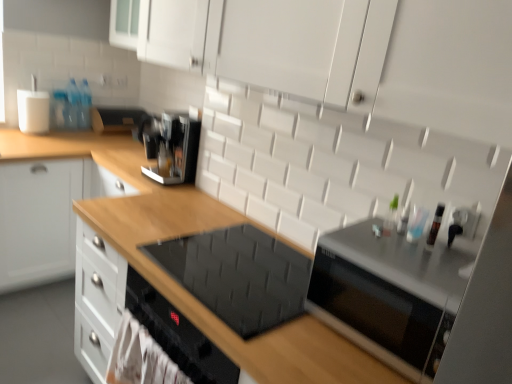
In the scene shown: Measure the distance between point (115, 131) and camera.

Point (115, 131) and camera are 9.15 feet apart.

Where is `black glass cooktop at center`? The image size is (512, 384). black glass cooktop at center is located at coordinates (238, 275).

Where is `sleek metallic coffee maker at upper center`? Image resolution: width=512 pixels, height=384 pixels. sleek metallic coffee maker at upper center is located at coordinates (172, 148).

The image size is (512, 384). I want to click on wooden drawer at left, so click(45, 216).

At what (x,y) coordinates should I click in order to perform the action: click on sleek metallic microwave at right, which is the 2th appliance in top-to-bottom order. Please return your answer as a coordinate pair (x, y). The width and height of the screenshot is (512, 384). Looking at the image, I should click on (388, 294).

What do you see at coordinates (388, 294) in the screenshot? This screenshot has height=384, width=512. I see `sleek metallic microwave at right, the first appliance from the front` at bounding box center [388, 294].

In order to click on transparent plastic bottle at upper right, the 1th bottle from the right in this screenshot , I will do `click(435, 226)`.

Choose the correct answer: Is black glass cooktop at center inside clear plastic bottle at upper left, acting as the first bottle starting from the left, or outside it?

black glass cooktop at center cannot be found inside clear plastic bottle at upper left, acting as the first bottle starting from the left.

How much distance is there between black glass cooktop at center and clear plastic bottle at upper left, acting as the second bottle starting from the right?

black glass cooktop at center and clear plastic bottle at upper left, acting as the second bottle starting from the right, are 5.71 feet apart from each other.

Considering the positions of objects black glass cooktop at center and clear plastic bottle at upper left, the second bottle in the front-to-back sequence, in the image provided, who is more to the right, black glass cooktop at center or clear plastic bottle at upper left, the second bottle in the front-to-back sequence,?

black glass cooktop at center.

Is black glass cooktop at center aimed at clear plastic bottle at upper left, the second bottle in the front-to-back sequence?

No.

Measure the distance from clear plastic bottle at upper left, which appears as the 1th bottle when viewed from the top, to satin black toaster at upper center, the 1th appliance in the back-to-front sequence.

clear plastic bottle at upper left, which appears as the 1th bottle when viewed from the top, and satin black toaster at upper center, the 1th appliance in the back-to-front sequence, are 5.46 inches apart from each other.

Is clear plastic bottle at upper left, positioned as the first bottle in back-to-front order, positioned far away from satin black toaster at upper center, the 1th appliance in the back-to-front sequence?

No, there isn't a large distance between clear plastic bottle at upper left, positioned as the first bottle in back-to-front order, and satin black toaster at upper center, the 1th appliance in the back-to-front sequence.

Is clear plastic bottle at upper left, which is counted as the second bottle, starting from the bottom, to the right of satin black toaster at upper center, arranged as the 2th appliance when ordered from the bottom, from the viewer's perspective?

Incorrect, clear plastic bottle at upper left, which is counted as the second bottle, starting from the bottom, is not on the right side of satin black toaster at upper center, arranged as the 2th appliance when ordered from the bottom.

From the image's perspective, which is below, clear plastic bottle at upper left, acting as the second bottle starting from the right, or satin black toaster at upper center, the 1th appliance in the back-to-front sequence?

satin black toaster at upper center, the 1th appliance in the back-to-front sequence, is shown below in the image.

Which object is positioned more to the left, sleek metallic coffee maker at upper center or satin black toaster at upper center, the 2th appliance from the right?

From the viewer's perspective, satin black toaster at upper center, the 2th appliance from the right, appears more on the left side.

Considering the relative positions of sleek metallic coffee maker at upper center and satin black toaster at upper center, the 2th appliance when ordered from front to back, in the image provided, is sleek metallic coffee maker at upper center behind satin black toaster at upper center, the 2th appliance when ordered from front to back,?

That is False.

Looking at the image, does sleek metallic coffee maker at upper center seem bigger or smaller compared to satin black toaster at upper center, arranged as the 1th appliance when viewed from the left?

Considering their sizes, sleek metallic coffee maker at upper center takes up more space than satin black toaster at upper center, arranged as the 1th appliance when viewed from the left.

What's the angular difference between sleek metallic coffee maker at upper center and satin black toaster at upper center, the 1th appliance in the back-to-front sequence,'s facing directions?

There is a 88.2-degree angle between the facing directions of sleek metallic coffee maker at upper center and satin black toaster at upper center, the 1th appliance in the back-to-front sequence.

Locate an element on the screen. appliance that appears behind the wooden drawer at left is located at coordinates (115, 119).

Between wooden drawer at left and satin black toaster at upper center, arranged as the 2th appliance when ordered from the bottom, which one has less height?

satin black toaster at upper center, arranged as the 2th appliance when ordered from the bottom.

Is wooden drawer at left looking in the opposite direction of satin black toaster at upper center, the 2th appliance when ordered from front to back?

No, wooden drawer at left is not facing the opposite direction of satin black toaster at upper center, the 2th appliance when ordered from front to back.

Is wooden drawer at left not within satin black toaster at upper center, arranged as the 2th appliance when ordered from the bottom?

wooden drawer at left lies outside satin black toaster at upper center, arranged as the 2th appliance when ordered from the bottom,'s area.

In terms of height, does satin black toaster at upper center, the 1th appliance in the back-to-front sequence, look taller or shorter compared to black glass cooktop at center?

Clearly, satin black toaster at upper center, the 1th appliance in the back-to-front sequence, is shorter compared to black glass cooktop at center.

From a real-world perspective, is satin black toaster at upper center, arranged as the 1th appliance when viewed from the left, positioned under black glass cooktop at center based on gravity?

Incorrect, from a real-world perspective, satin black toaster at upper center, arranged as the 1th appliance when viewed from the left, is higher than black glass cooktop at center.

Find the location of a particular element. The height and width of the screenshot is (384, 512). countertop that is in front of the satin black toaster at upper center, the 1th appliance in the back-to-front sequence is located at coordinates (189, 233).

Is satin black toaster at upper center, the 1th appliance in the back-to-front sequence, facing towards black glass cooktop at center?

No, satin black toaster at upper center, the 1th appliance in the back-to-front sequence, is not oriented towards black glass cooktop at center.

In the scene shown: In the image, is sleek metallic microwave at right, positioned as the 2th appliance in back-to-front order, positioned in front of or behind wooden drawer at left?

Clearly, sleek metallic microwave at right, positioned as the 2th appliance in back-to-front order, is in front of wooden drawer at left.

Looking at this image, considering the positions of objects sleek metallic microwave at right, the first appliance from the front, and wooden drawer at left in the image provided, who is more to the right, sleek metallic microwave at right, the first appliance from the front, or wooden drawer at left?

sleek metallic microwave at right, the first appliance from the front, is more to the right.

From the image's perspective, is sleek metallic microwave at right, positioned as the 2th appliance in left-to-right order, under wooden drawer at left?

Yes.

Is point (378, 327) farther from viewer compared to point (47, 215)?

No, it is not.

Is black glass cooktop at center in front of or behind sleek metallic coffee maker at upper center in the image?

black glass cooktop at center is in front of sleek metallic coffee maker at upper center.

Is black glass cooktop at center completely or partially outside of sleek metallic coffee maker at upper center?

black glass cooktop at center lies outside sleek metallic coffee maker at upper center's area.

Is there a large distance between black glass cooktop at center and sleek metallic coffee maker at upper center?

black glass cooktop at center is actually quite close to sleek metallic coffee maker at upper center.

From the image's perspective, is black glass cooktop at center under sleek metallic coffee maker at upper center?

Indeed, from the image's perspective, black glass cooktop at center is shown beneath sleek metallic coffee maker at upper center.

From a real-world perspective, starting from the black glass cooktop at center, which bottle is the 1st one vertically above it? Please provide its 2D coordinates.

[(84, 106)]

What are the coordinates of `the 1st appliance in front of the clear plastic bottle at upper left, positioned as the first bottle in back-to-front order` in the screenshot? It's located at (115, 119).

From the image, which object appears to be farther from clear plastic bottle at upper left, acting as the second bottle starting from the right, wooden drawer at left or black glass cooktop at center?

black glass cooktop at center lies further to clear plastic bottle at upper left, acting as the second bottle starting from the right, than the other object.

From the picture: Estimate the real-world distances between objects in this image. Which object is closer to wooden drawer at left, satin black toaster at upper center, the 1th appliance in the back-to-front sequence, or black glass cooktop at center?

The object closer to wooden drawer at left is black glass cooktop at center.

From the image, which object appears to be farther from sleek metallic coffee maker at upper center, transparent plastic bottle at upper right, the 1th bottle from the right, or clear plastic bottle at upper left, acting as the first bottle starting from the left?

The object further to sleek metallic coffee maker at upper center is transparent plastic bottle at upper right, the 1th bottle from the right.

Which object lies nearer to the anchor point sleek metallic coffee maker at upper center, transparent plastic bottle at upper right, the first bottle in the front-to-back sequence, or satin black toaster at upper center, the 1th appliance in the back-to-front sequence?

Among the two, satin black toaster at upper center, the 1th appliance in the back-to-front sequence, is located nearer to sleek metallic coffee maker at upper center.

Looking at the image, which one is located further to clear plastic bottle at upper left, acting as the second bottle starting from the right, sleek metallic coffee maker at upper center or black glass cooktop at center?

The object further to clear plastic bottle at upper left, acting as the second bottle starting from the right, is black glass cooktop at center.

From the image, which object appears to be nearer to sleek metallic coffee maker at upper center, wooden drawer at left or transparent plastic bottle at upper right, marked as the second bottle in a top-to-bottom arrangement?

Based on the image, wooden drawer at left appears to be nearer to sleek metallic coffee maker at upper center.

From the picture: Considering their positions, is black glass cooktop at center positioned closer to sleek metallic coffee maker at upper center than transparent plastic bottle at upper right, the first bottle in the front-to-back sequence?

black glass cooktop at center is positioned closer to the anchor sleek metallic coffee maker at upper center.

Based on their spatial positions, is transparent plastic bottle at upper right, positioned as the 2th bottle in left-to-right order, or sleek metallic coffee maker at upper center further from sleek metallic microwave at right, positioned as the 2th appliance in left-to-right order?

sleek metallic coffee maker at upper center.

The height and width of the screenshot is (384, 512). What are the coordinates of `home appliance positioned between black glass cooktop at center and clear plastic bottle at upper left, which is counted as the second bottle, starting from the bottom, from near to far` in the screenshot? It's located at (238, 275).

The image size is (512, 384). Identify the location of bottle located between sleek metallic microwave at right, positioned as the 2th appliance in back-to-front order, and satin black toaster at upper center, the 2th appliance from the right, in the depth direction. (435, 226).

You are a GUI agent. You are given a task and a screenshot of the screen. Output one action in this format:
    pyautogui.click(x=<x>, y=<y>)
    Task: Click on the countertop between wooden drawer at left and sleek metallic microwave at right, the first appliance from the front
    The height and width of the screenshot is (384, 512).
    Given the screenshot: What is the action you would take?
    pyautogui.click(x=189, y=233)

Locate an element on the screen. Image resolution: width=512 pixels, height=384 pixels. home appliance between sleek metallic microwave at right, which is the 2th appliance in top-to-bottom order, and satin black toaster at upper center, the 2th appliance when ordered from front to back, along the z-axis is located at coordinates (238, 275).